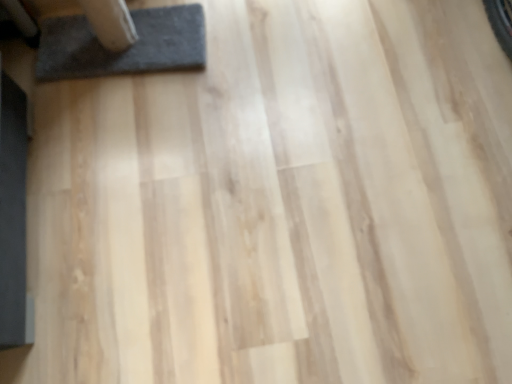
Describe the element at coordinates (124, 49) in the screenshot. I see `black rubber mat at upper left` at that location.

Locate an element on the screen. black rubber mat at upper left is located at coordinates (124, 49).

This screenshot has width=512, height=384. I want to click on black rubber mat at upper left, so (x=124, y=49).